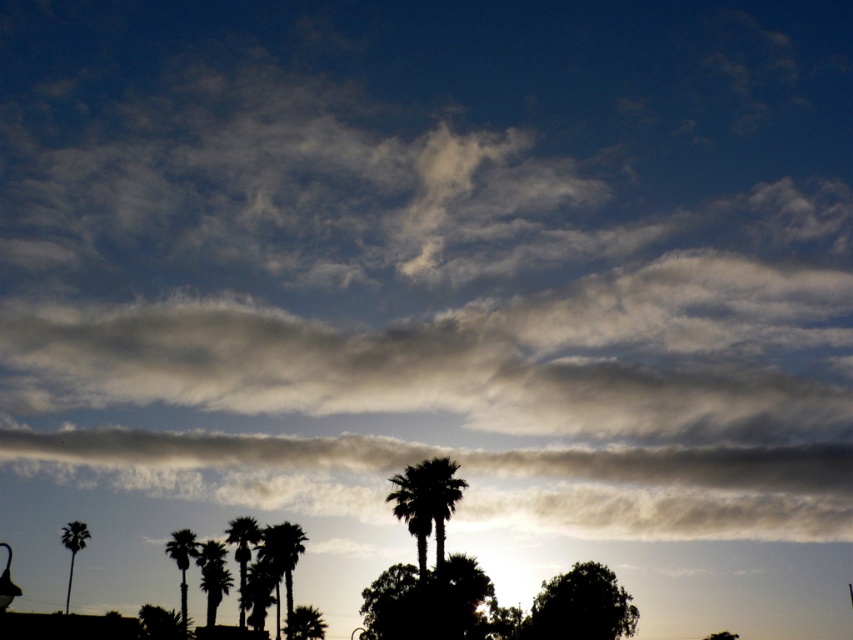
Between dark green leafy tree at center and dark green leafy palm tree at center, which one is positioned higher?

Positioned higher is dark green leafy palm tree at center.

Is dark green leafy tree at center wider than dark green leafy palm tree at center?

Yes, dark green leafy tree at center is wider than dark green leafy palm tree at center.

Which is in front, point (543, 602) or point (442, 474)?

Point (442, 474)

Find the location of a particular element. The width and height of the screenshot is (853, 640). dark green leafy tree at center is located at coordinates (579, 605).

Is green leafy palm tree at lower center below green leafy palm tree at center?

Incorrect, green leafy palm tree at lower center is not positioned below green leafy palm tree at center.

Can you confirm if green leafy palm tree at lower center is positioned above green leafy palm tree at center?

Indeed, green leafy palm tree at lower center is positioned over green leafy palm tree at center.

What are the coordinates of `green leafy palm tree at lower center` in the screenshot? It's located at (212, 579).

Is dark green leafy tree at center shorter than silhouette palm tree at lower left?

Correct, dark green leafy tree at center is not as tall as silhouette palm tree at lower left.

Which of these two, dark green leafy tree at center or silhouette palm tree at lower left, stands shorter?

dark green leafy tree at center

Which is behind, point (581, 580) or point (192, 552)?

The point (192, 552) is behind.

Where is `dark green leafy tree at center`? This screenshot has width=853, height=640. dark green leafy tree at center is located at coordinates (579, 605).